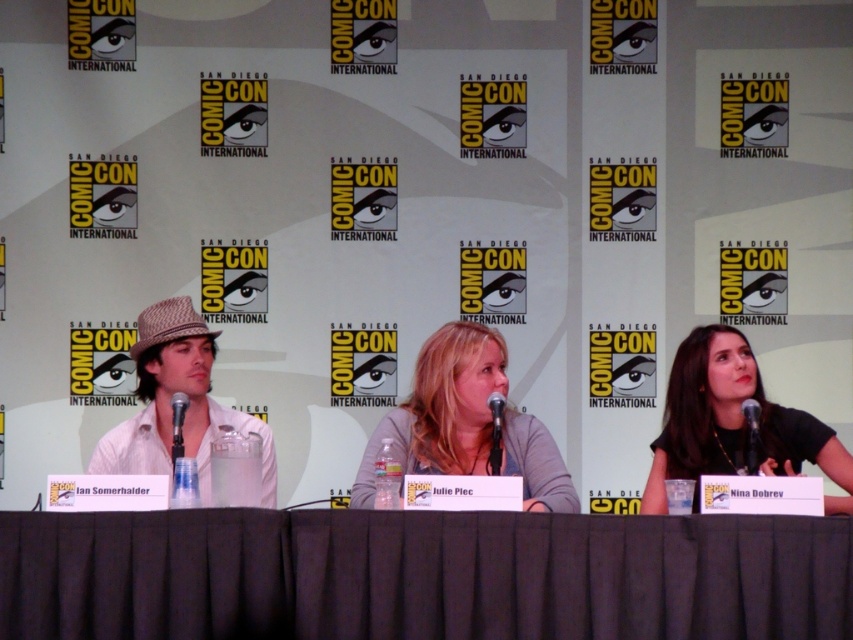
You are attending Comic Con and want to know where the dark fabric table at center is located relative to the white cotton shirt at left. Can you tell me if the table is above or below the shirt?

The dark fabric table at center is positioned under the white cotton shirt at left, so the table is below the shirt.

You are a photographer at Comic Con International trying to capture a clear shot of the dark fabric table at center and the white cotton shirt at left. Which object is closer to the camera?

The dark fabric table at center is not as tall as the white cotton shirt at left, so the white cotton shirt at left is closer to the camera.

You are a photographer standing at the back of the room. You want to take a photo of the dark fabric table at center and ensure that all three participants seated around it are visible in the frame. Considering the distance between the photographer and the table, will you need to use a zoom lens to include everyone?

The participants are 11.84 feet apart around the dark fabric table at center, so a zoom lens may be necessary to ensure all three are visible in the frame from the photographer position at the back.